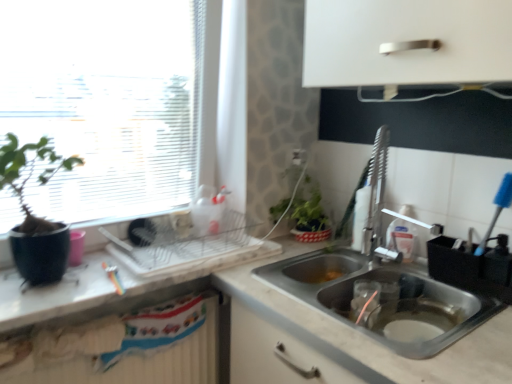
Question: From the image's perspective, is white marble countertop at lower right, which appears as the second countertop when viewed from the top, beneath matte black pot at left?

Choices:
 (A) no
 (B) yes

Answer: (B)

Question: Is white marble countertop at lower right, which appears as the second countertop when viewed from the top, bigger than matte black pot at left?

Choices:
 (A) yes
 (B) no

Answer: (A)

Question: Does white marble countertop at lower right, positioned as the 1th countertop in bottom-to-top order, have a greater height compared to matte black pot at left?

Choices:
 (A) yes
 (B) no

Answer: (A)

Question: Are white marble countertop at lower right, which appears as the second countertop when viewed from the top, and matte black pot at left located far from each other?

Choices:
 (A) yes
 (B) no

Answer: (B)

Question: Can you confirm if white marble countertop at lower right, positioned as the 1th countertop in bottom-to-top order, is positioned to the right of matte black pot at left?

Choices:
 (A) yes
 (B) no

Answer: (A)

Question: Considering their positions, is white textured radiator at lower left located in front of or behind stainless steel sink at lower right, acting as the 2th sink starting from the bottom?

Choices:
 (A) front
 (B) behind

Answer: (B)

Question: Considering the relative positions of white textured radiator at lower left and stainless steel sink at lower right, acting as the 2th sink starting from the bottom, in the image provided, is white textured radiator at lower left to the left or to the right of stainless steel sink at lower right, acting as the 2th sink starting from the bottom,?

Choices:
 (A) right
 (B) left

Answer: (B)

Question: Is white textured radiator at lower left taller or shorter than stainless steel sink at lower right, acting as the 2th sink starting from the bottom?

Choices:
 (A) short
 (B) tall

Answer: (A)

Question: Is white textured radiator at lower left bigger or smaller than stainless steel sink at lower right, which is the first sink in top-to-bottom order?

Choices:
 (A) big
 (B) small

Answer: (B)

Question: Considering the relative positions of black plastic utensil holder at sink, acting as the 2th appliance starting from the left, and stainless steel sink at lower right, acting as the second sink starting from the top, in the image provided, is black plastic utensil holder at sink, acting as the 2th appliance starting from the left, to the left or to the right of stainless steel sink at lower right, acting as the second sink starting from the top,?

Choices:
 (A) left
 (B) right

Answer: (B)

Question: Is black plastic utensil holder at sink, the first appliance viewed from the right, taller or shorter than stainless steel sink at lower right, acting as the second sink starting from the top?

Choices:
 (A) tall
 (B) short

Answer: (B)

Question: Would you say black plastic utensil holder at sink, acting as the 2th appliance starting from the left, is inside or outside stainless steel sink at lower right, the first sink ordered from the bottom?

Choices:
 (A) outside
 (B) inside

Answer: (A)

Question: From the image's perspective, relative to stainless steel sink at lower right, the first sink ordered from the bottom, is black plastic utensil holder at sink, the first appliance viewed from the right, above or below?

Choices:
 (A) below
 (B) above

Answer: (B)

Question: Is point (47, 231) positioned closer to the camera than point (369, 203)?

Choices:
 (A) closer
 (B) farther

Answer: (A)

Question: Would you say matte black pot at left is inside or outside stainless steel sink at lower right, which is the first sink in top-to-bottom order?

Choices:
 (A) inside
 (B) outside

Answer: (B)